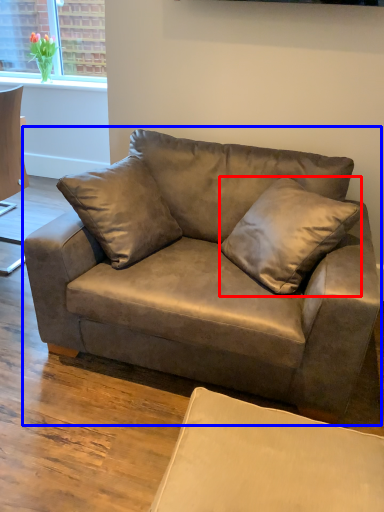
Question: Which object appears farthest to the camera in this image, pillow (highlighted by a red box) or studio couch (highlighted by a blue box)?

Choices:
 (A) pillow
 (B) studio couch

Answer: (A)